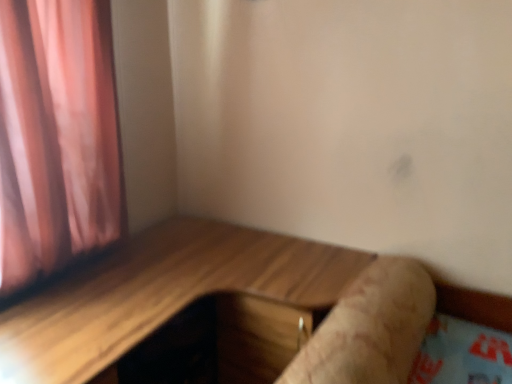
Image resolution: width=512 pixels, height=384 pixels. I want to click on empty space that is ontop of wooden table at center (from a real-world perspective), so click(x=187, y=277).